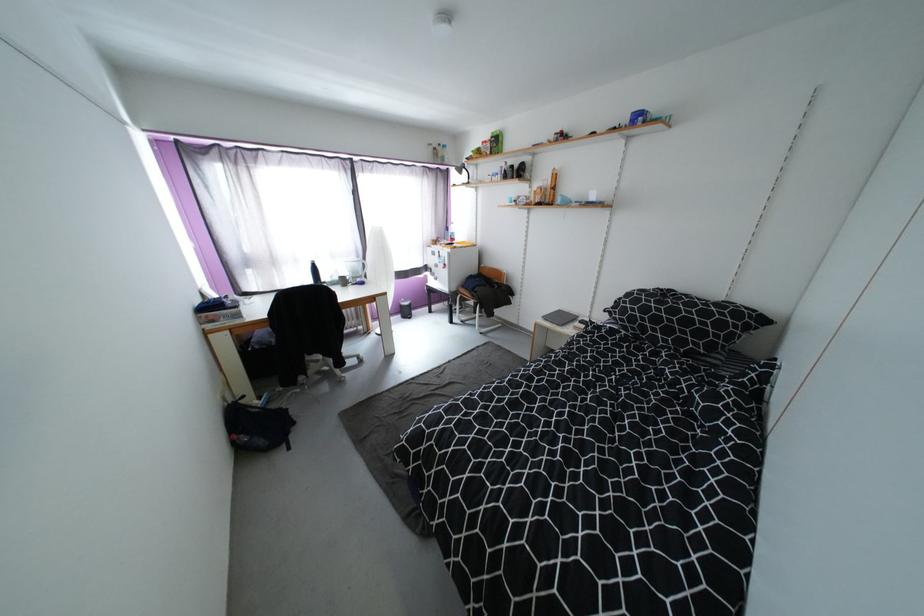
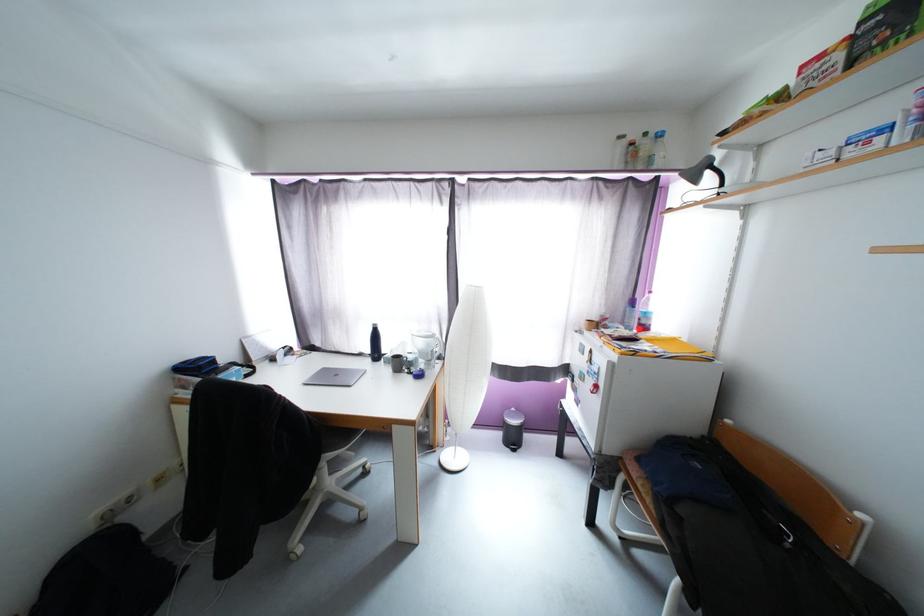
Find the pixel in the second image that matches (406,317) in the first image.

(505, 437)